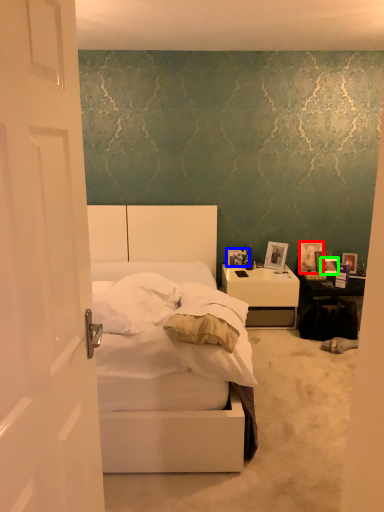
Question: Estimate the real-world distances between objects in this image. Which object is farther from picture frame (highlighted by a red box), picture frame (highlighted by a blue box) or picture frame (highlighted by a green box)?

Choices:
 (A) picture frame
 (B) picture frame

Answer: (A)